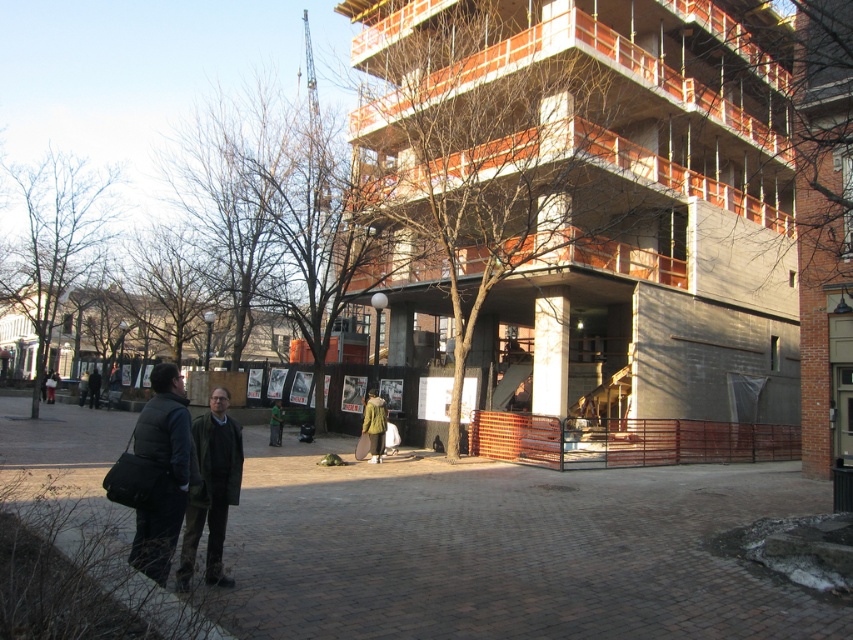
You are a construction worker standing in the foreground of the urban scene. You need to access the partially constructed building. Which clothing item is blocking your view of the building? Please choose between the dark gray puffer vest at center and the dark green fabric jacket at center.

The dark gray puffer vest at center is positioned over the dark green fabric jacket at center, so the dark gray puffer vest at center is blocking your view of the building.

You are a construction worker observing the partially constructed building. You notice two people wearing a dark gray puffer vest at center and a dark green fabric jacket at center. Which clothing item is wider?

The dark gray puffer vest at center is wider than the dark green fabric jacket at center.

From the picture: You are a delivery person trying to navigate through the construction site. You see a brown wooden tree at upper center and a dark green fabric jacket at center. Which object is wider from your perspective?

The brown wooden tree at upper center might be wider than the dark green fabric jacket at center, so it appears wider from your perspective.